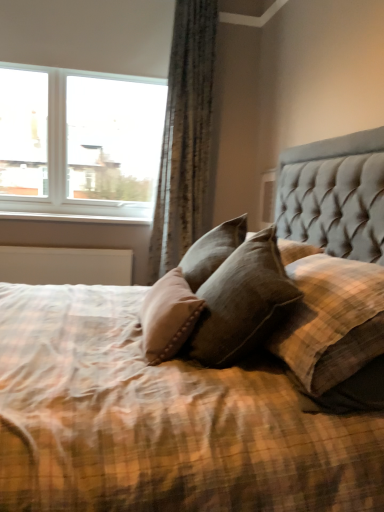
Question: From a real-world perspective, is white glass window at upper left on brown textured pillow at center?

Choices:
 (A) no
 (B) yes

Answer: (B)

Question: Is the position of white glass window at upper left less distant than that of brown textured pillow at center?

Choices:
 (A) yes
 (B) no

Answer: (B)

Question: From a real-world perspective, is white glass window at upper left under brown textured pillow at center?

Choices:
 (A) no
 (B) yes

Answer: (A)

Question: Is brown textured pillow at center at the back of white glass window at upper left?

Choices:
 (A) yes
 (B) no

Answer: (B)

Question: Is white glass window at upper left wider than brown textured pillow at center?

Choices:
 (A) yes
 (B) no

Answer: (B)

Question: In terms of width, does white glass window at upper left look wider or thinner when compared to textured gray curtain at upper left?

Choices:
 (A) thin
 (B) wide

Answer: (A)

Question: From a real-world perspective, relative to textured gray curtain at upper left, is white glass window at upper left vertically above or below?

Choices:
 (A) below
 (B) above

Answer: (B)

Question: From the image's perspective, is white glass window at upper left located above or below textured gray curtain at upper left?

Choices:
 (A) above
 (B) below

Answer: (A)

Question: Is point (52, 157) closer or farther from the camera than point (187, 28)?

Choices:
 (A) farther
 (B) closer

Answer: (A)

Question: From the image's perspective, is white glass window at upper left positioned above or below brown textured pillow at center?

Choices:
 (A) below
 (B) above

Answer: (B)

Question: From a real-world perspective, relative to brown textured pillow at center, is white glass window at upper left vertically above or below?

Choices:
 (A) below
 (B) above

Answer: (B)

Question: Is white glass window at upper left situated inside brown textured pillow at center or outside?

Choices:
 (A) inside
 (B) outside

Answer: (B)

Question: Considering the relative positions of white glass window at upper left and brown textured pillow at center in the image provided, is white glass window at upper left to the left or to the right of brown textured pillow at center?

Choices:
 (A) left
 (B) right

Answer: (A)

Question: Looking at their shapes, would you say textured gray curtain at upper left is wider or thinner than white glass window at upper left?

Choices:
 (A) thin
 (B) wide

Answer: (B)

Question: From a real-world perspective, is textured gray curtain at upper left above or below white glass window at upper left?

Choices:
 (A) below
 (B) above

Answer: (A)